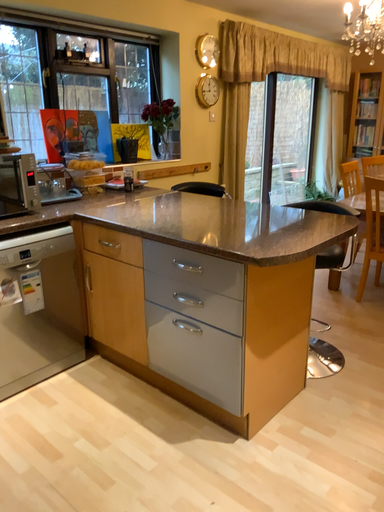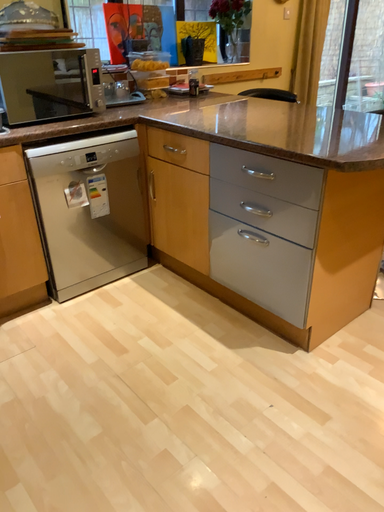
Question: Which way did the camera rotate in the video?

Choices:
 (A) rotated right
 (B) rotated left

Answer: (B)